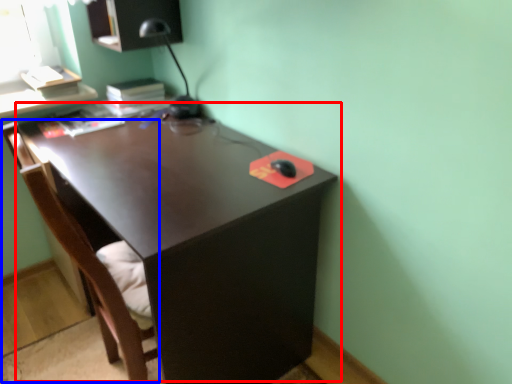
Question: Among these objects, which one is nearest to the camera, desk (highlighted by a red box) or swivel chair (highlighted by a blue box)?

Choices:
 (A) desk
 (B) swivel chair

Answer: (B)